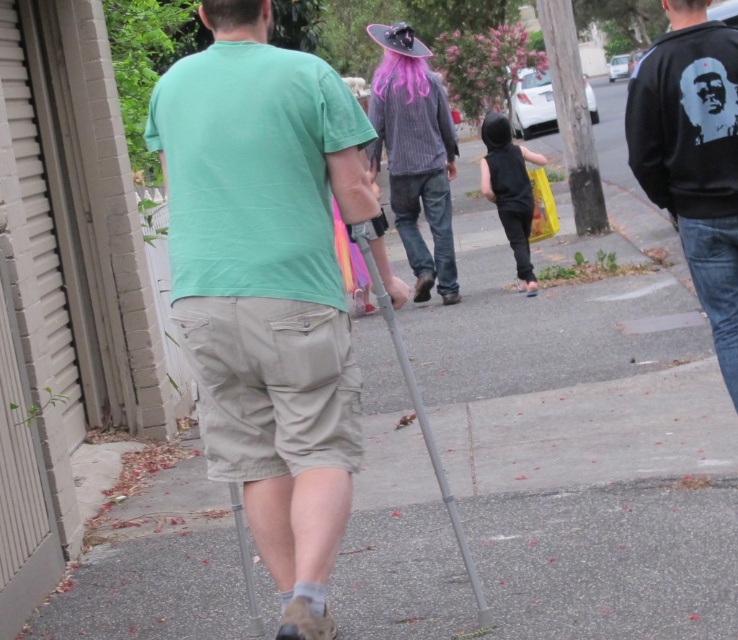
You are standing on the sidewalk and see two points marked in the image. The first point is at coordinates point (387, 48) and the second point is at coordinates point (248, 572). Which point is closer to you?

Point (387, 48) is closer to you because it is further to the viewer than point (248, 572).